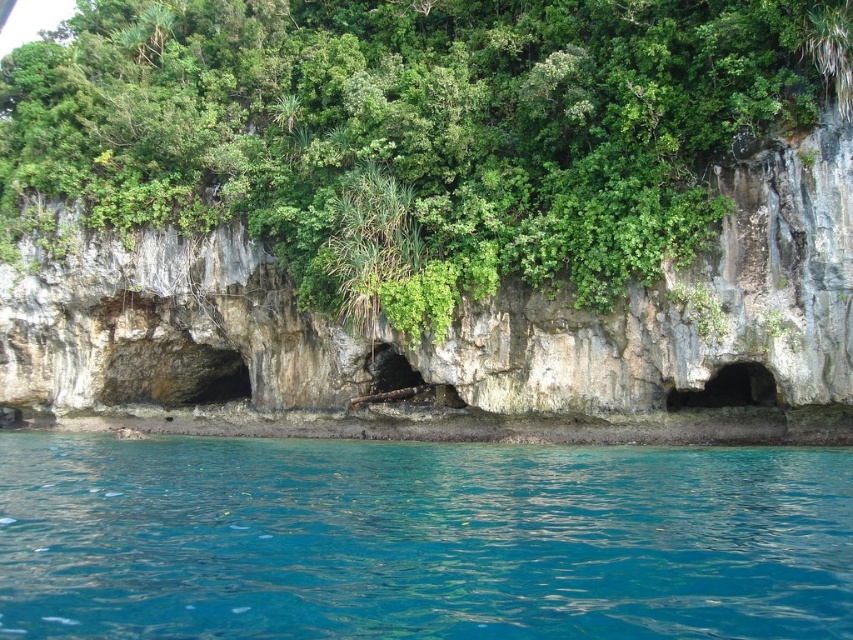
Is point (788, 20) farther from viewer compared to point (218, 460)?

That is False.

Between green leafy tree at center and clear blue water at lower center, which one appears on the left side from the viewer's perspective?

Positioned to the left is green leafy tree at center.

Does point (604, 291) lie in front of point (788, 620)?

No.

Image resolution: width=853 pixels, height=640 pixels. I want to click on green leafy tree at center, so click(416, 122).